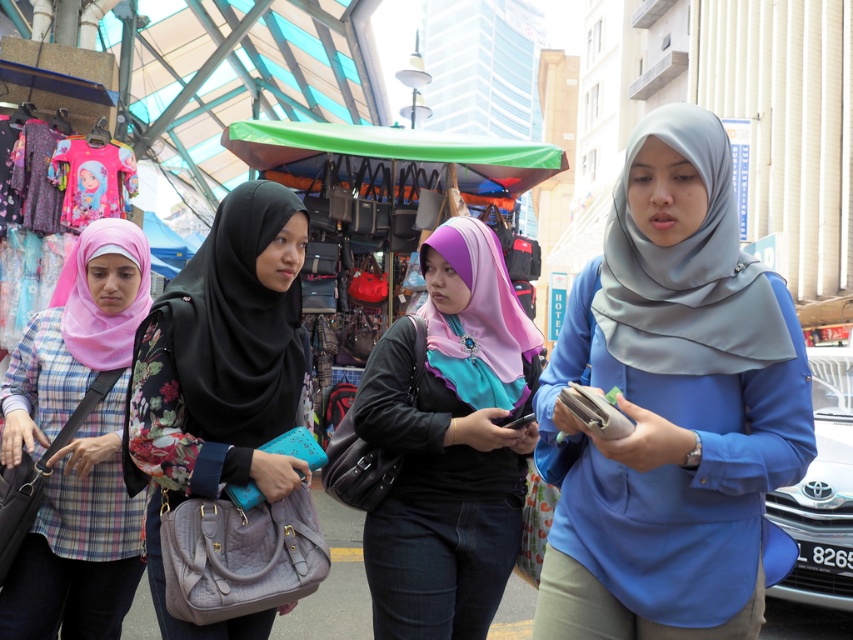
Can you confirm if purple satin hijab at center is positioned to the left of matte black hijab at center?

No, purple satin hijab at center is not to the left of matte black hijab at center.

Which of these two, purple satin hijab at center or matte black hijab at center, stands shorter?

matte black hijab at center

Which is behind, point (389, 381) or point (273, 458)?

The point (389, 381) is more distant.

The image size is (853, 640). In order to click on purple satin hijab at center in this screenshot , I will do `click(450, 444)`.

Which is above, matte gray hijab at center or matte pink hijab at left?

matte gray hijab at center is above.

Is matte gray hijab at center below matte pink hijab at left?

Actually, matte gray hijab at center is above matte pink hijab at left.

Locate an element on the screen. matte gray hijab at center is located at coordinates (671, 406).

Where is `matte gray hijab at center`? This screenshot has height=640, width=853. matte gray hijab at center is located at coordinates [671, 406].

What do you see at coordinates (671, 406) in the screenshot?
I see `matte gray hijab at center` at bounding box center [671, 406].

Does matte gray hijab at center appear on the right side of matte black hijab at center?

Indeed, matte gray hijab at center is positioned on the right side of matte black hijab at center.

Looking at this image, who is more forward, (700,192) or (186,412)?

Point (700,192)

Image resolution: width=853 pixels, height=640 pixels. I want to click on matte gray hijab at center, so click(671, 406).